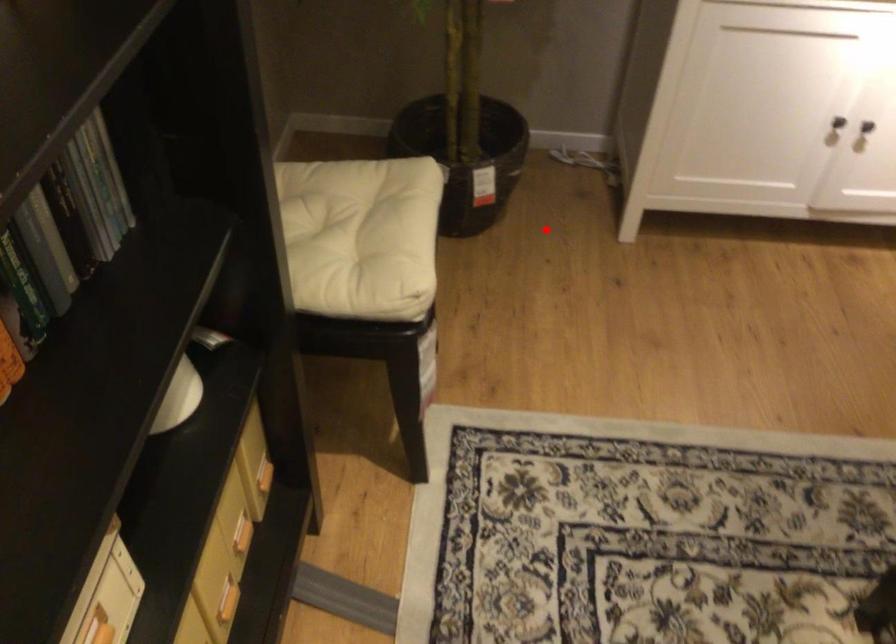
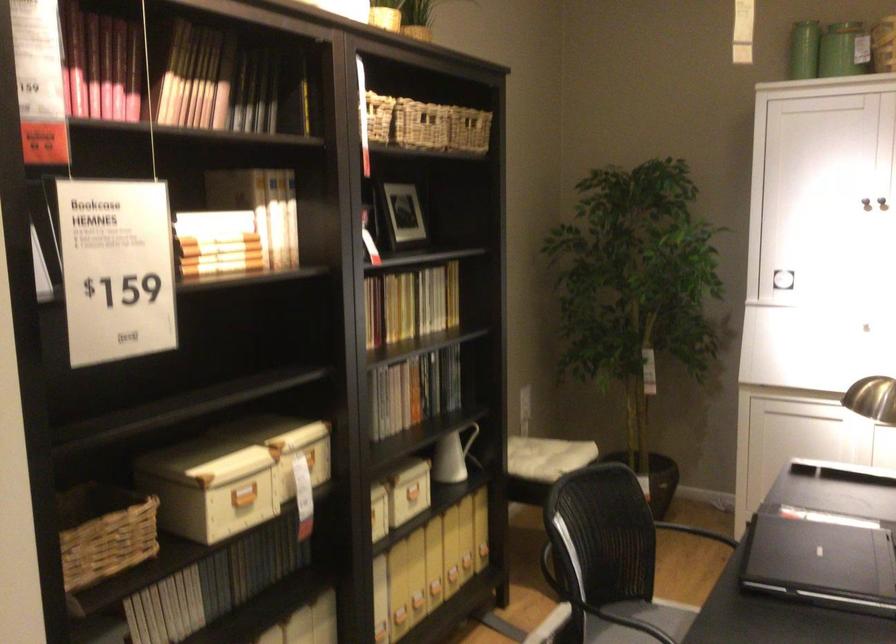
Locate, in the second image, the point that corresponds to the highlighted location in the first image.

(695, 532)